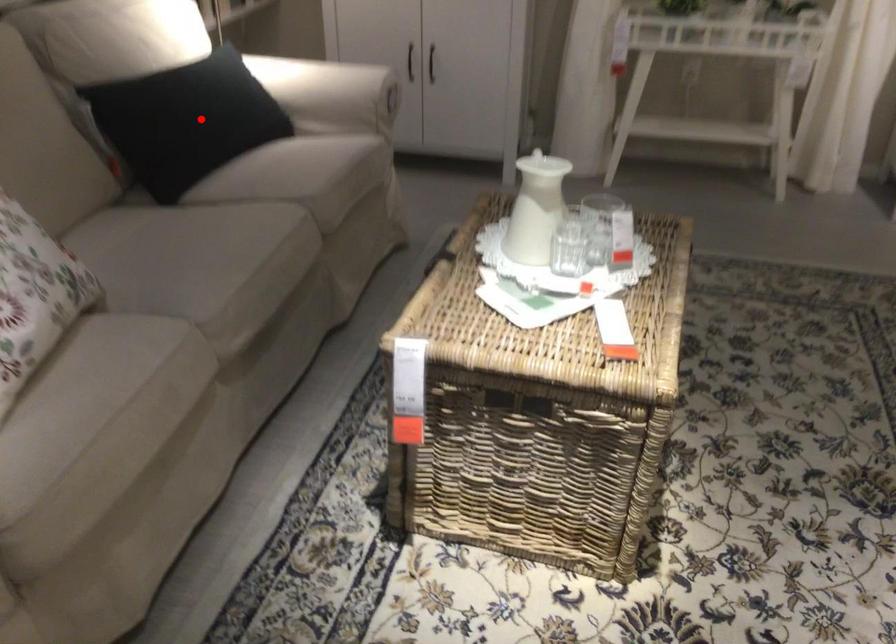
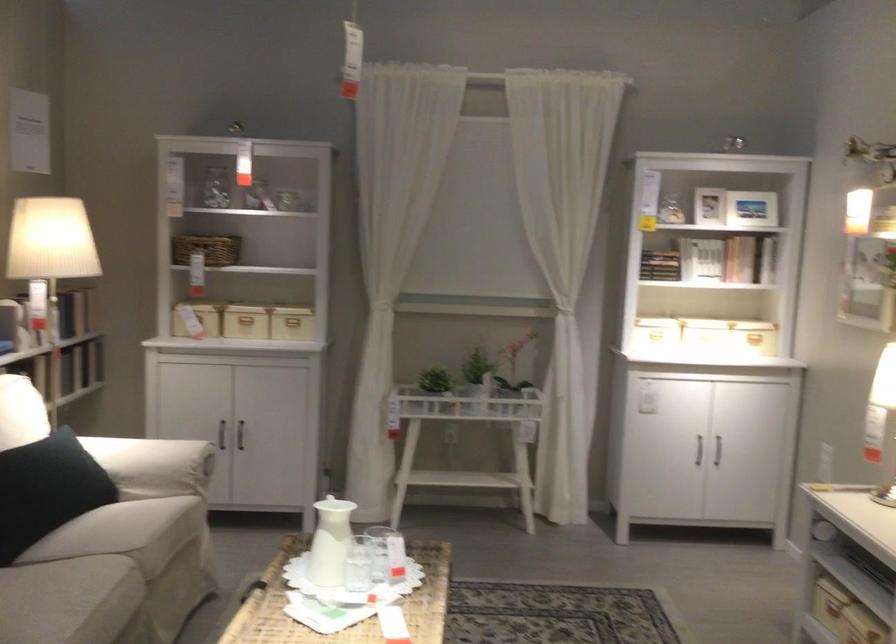
Question: I am providing you with two images of the same scene from different viewpoints. Image1 has a red point marked. In image2, the corresponding 3D location appears at what relative position? Reply with the corresponding letter.

Choices:
 (A) Closer
 (B) Farther

Answer: (B)